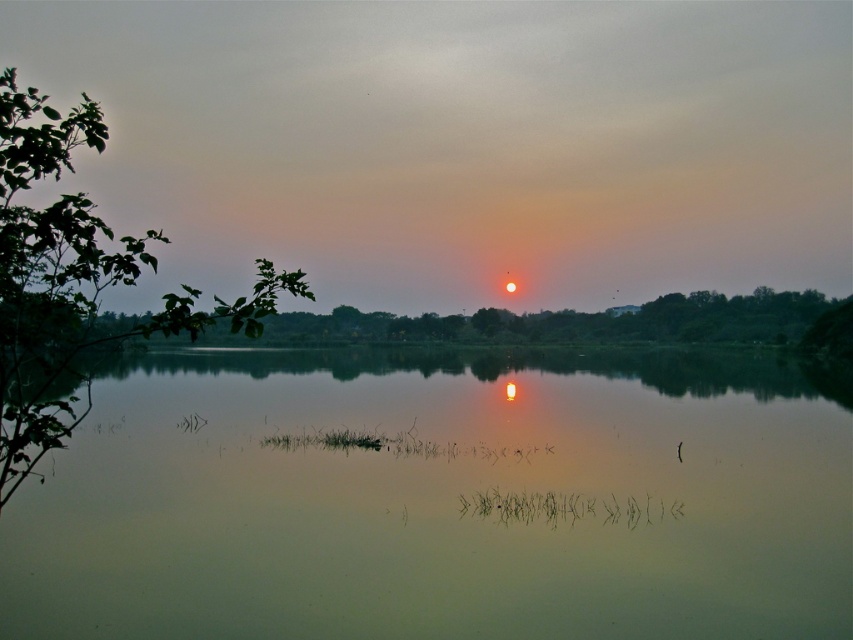
Question: Which point appears farthest from the camera in this image?

Choices:
 (A) (152, 541)
 (B) (96, 260)

Answer: (A)

Question: Considering the relative positions of smooth reflective water at center and green leafy branch at left in the image provided, where is smooth reflective water at center located with respect to green leafy branch at left?

Choices:
 (A) above
 (B) below

Answer: (B)

Question: Does smooth reflective water at center lie behind green leafy branch at left?

Choices:
 (A) no
 (B) yes

Answer: (B)

Question: Can you confirm if smooth reflective water at center is thinner than green leafy branch at left?

Choices:
 (A) no
 (B) yes

Answer: (B)